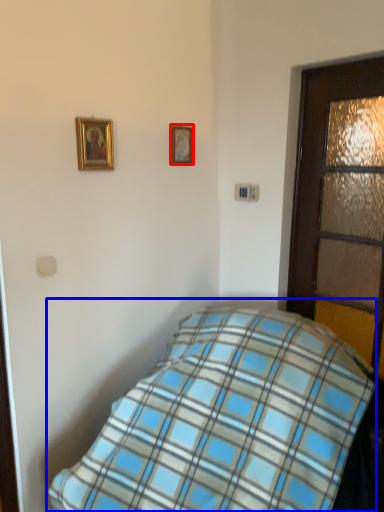
Question: Among these objects, which one is nearest to the camera, picture frame (highlighted by a red box) or bed (highlighted by a blue box)?

Choices:
 (A) picture frame
 (B) bed

Answer: (B)